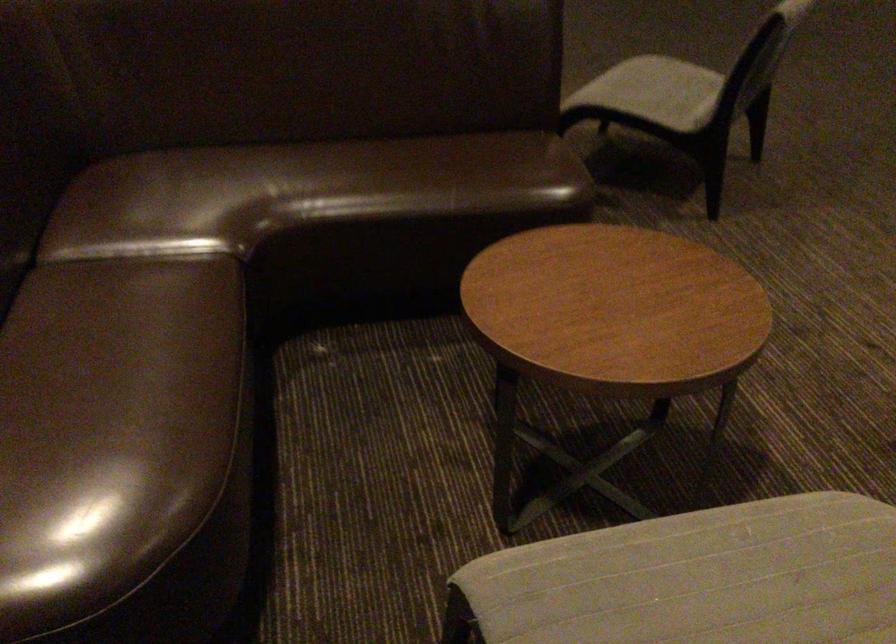
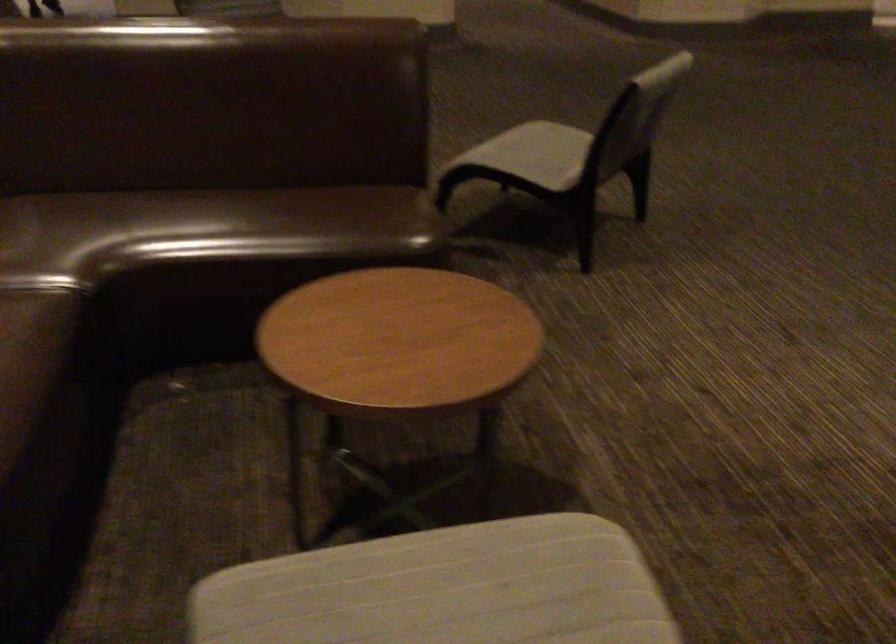
What movement of the cameraman would produce the second image?

The cameraman moved toward right, backward.